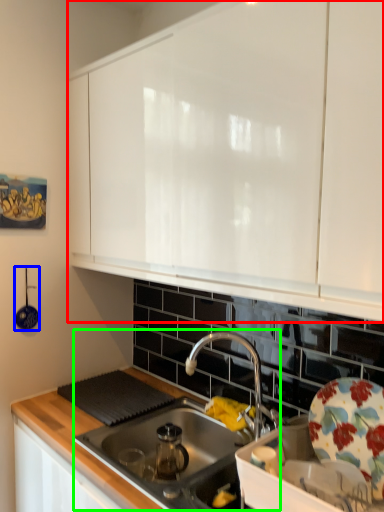
Question: Considering the real-world distances, which object is closest to cabinetry (highlighted by a red box)? appliance (highlighted by a blue box) or sink (highlighted by a green box).

Choices:
 (A) appliance
 (B) sink

Answer: (B)